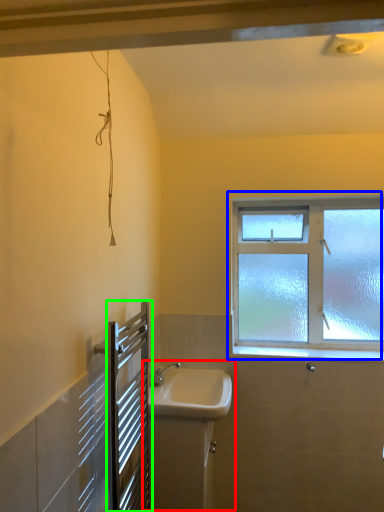
Question: Which object is the farthest from sink (highlighted by a red box)? Choose among these: window (highlighted by a blue box) or screen door (highlighted by a green box).

Choices:
 (A) window
 (B) screen door

Answer: (A)